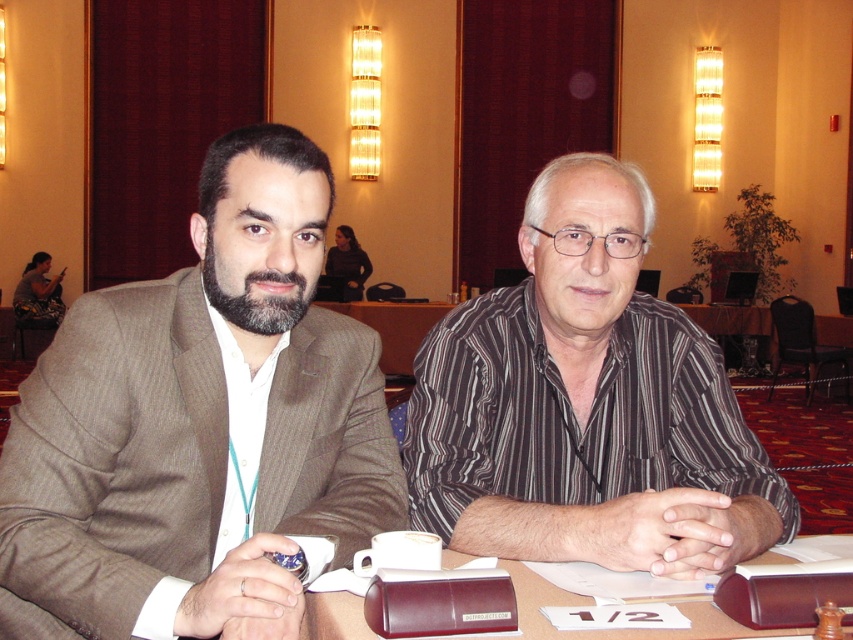
Question: Which of these objects is positioned farthest from the brown leather folder at center?

Choices:
 (A) brown pinstripe suit at left
 (B) striped cotton shirt at center

Answer: (B)

Question: Which object is the closest to the brown pinstripe suit at left?

Choices:
 (A) brown leather folder at center
 (B) striped cotton shirt at center

Answer: (B)

Question: Is brown pinstripe suit at left wider than striped cotton shirt at center?

Choices:
 (A) yes
 (B) no

Answer: (B)

Question: Is striped cotton shirt at center wider than brown leather folder at center?

Choices:
 (A) no
 (B) yes

Answer: (B)

Question: Does striped cotton shirt at center have a greater width compared to brown leather folder at center?

Choices:
 (A) no
 (B) yes

Answer: (B)

Question: Estimate the real-world distances between objects in this image. Which object is farther from the brown pinstripe suit at left?

Choices:
 (A) striped cotton shirt at center
 (B) brown leather folder at center

Answer: (B)